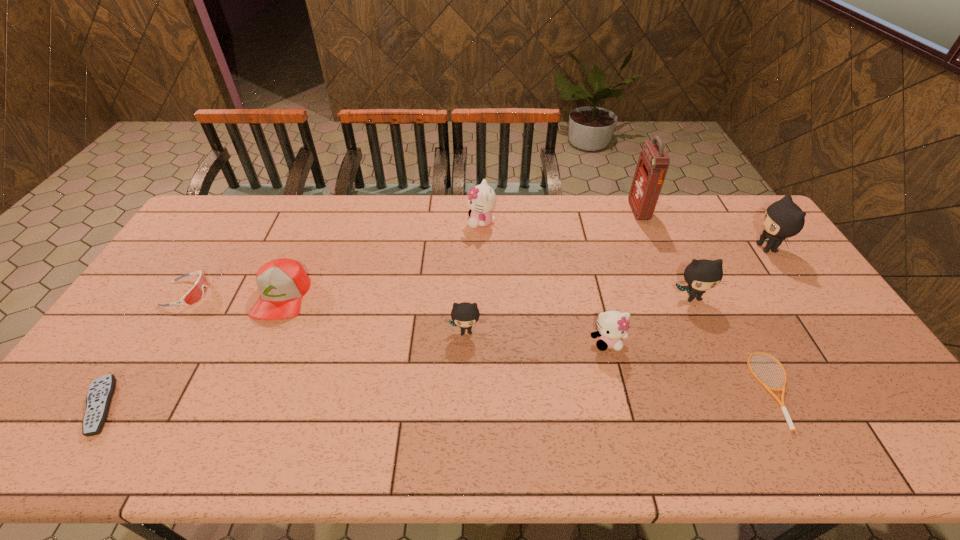
The image size is (960, 540). I want to click on the leftmost gray kitten, so click(x=464, y=315).

Where is `the smallest gray kitten`? The width and height of the screenshot is (960, 540). the smallest gray kitten is located at coordinates (464, 315).

Image resolution: width=960 pixels, height=540 pixels. I want to click on the seventh tallest object, so click(282, 283).

Identify the location of red baseball cap. (282, 283).

In order to click on the eighth tallest object in this screenshot , I will do `click(196, 292)`.

At what (x,y) coordinates should I click in order to perform the action: click on goggles. Please return your answer as a coordinate pair (x, y). This screenshot has height=540, width=960. Looking at the image, I should click on (196, 292).

Identify the location of remote control. point(101,390).

Where is `tennis racket`? tennis racket is located at coordinates (782, 406).

Where is `beige tennis racket`? The image size is (960, 540). beige tennis racket is located at coordinates (782, 406).

Locate an element on the screen. The height and width of the screenshot is (540, 960). free space located on the front-facing side of the tallest object is located at coordinates (523, 211).